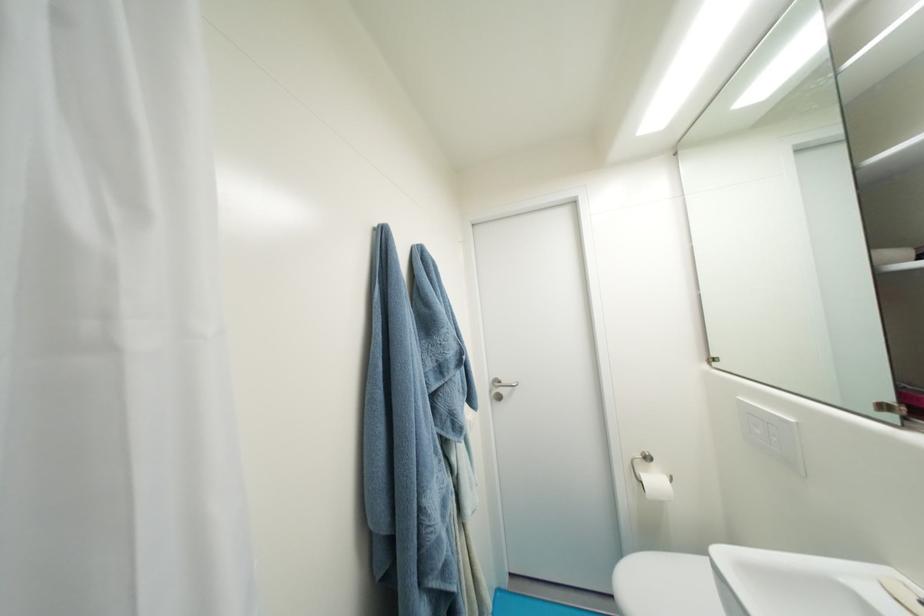
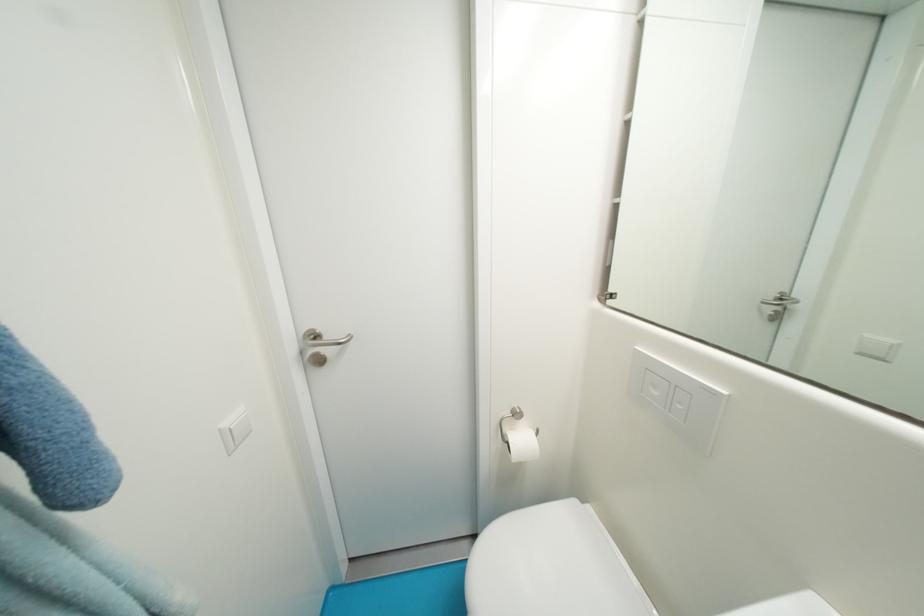
Where in the second image is the point corresponding to (764,434) from the first image?

(662, 395)